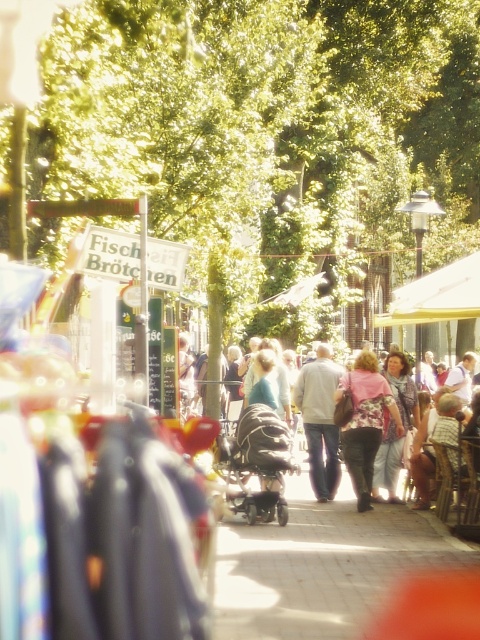
Question: Does smooth concrete pavement at center appear on the right side of light blue fabric dress at center?

Choices:
 (A) no
 (B) yes

Answer: (A)

Question: Does dark gray plastic baby carriage at center appear on the left side of light gray sweater at center?

Choices:
 (A) yes
 (B) no

Answer: (A)

Question: Considering the real-world distances, which object is closest to the light gray sweater at center?

Choices:
 (A) dark gray plastic baby carriage at center
 (B) light blue fabric dress at center
 (C) smooth concrete pavement at center

Answer: (B)

Question: Can you confirm if light gray sweater at center is smaller than light blue fabric dress at center?

Choices:
 (A) no
 (B) yes

Answer: (B)

Question: Which point is closer to the camera taking this photo?

Choices:
 (A) (263, 637)
 (B) (278, 508)
 (C) (369, 362)
 (D) (252, 522)

Answer: (A)

Question: Which is farther from the blue denim jeans at center?

Choices:
 (A) smooth concrete pavement at center
 (B) dark gray plastic baby carriage at center
 (C) floral fabric blouse at center

Answer: (A)